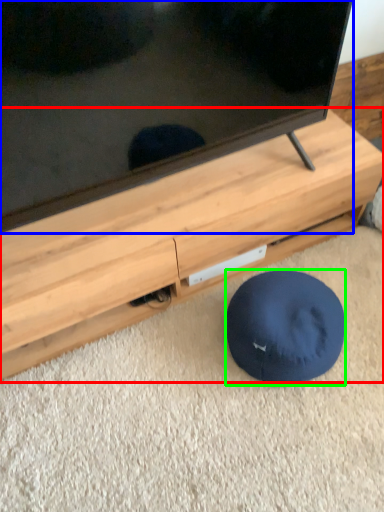
Question: Which object is positioned farthest from furniture (highlighted by a red box)? Select from television (highlighted by a blue box) and dog bed (highlighted by a green box).

Choices:
 (A) television
 (B) dog bed

Answer: (B)